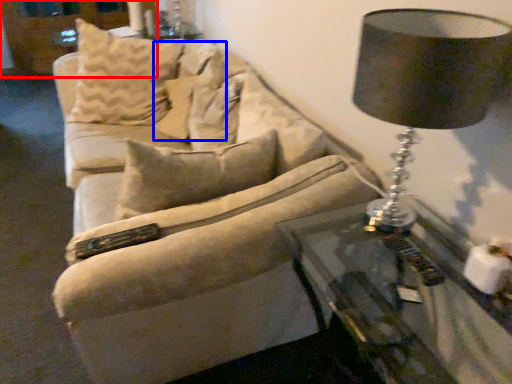
Question: Among these objects, which one is nearest to the camera, dresser (highlighted by a red box) or pillow (highlighted by a blue box)?

Choices:
 (A) dresser
 (B) pillow

Answer: (B)